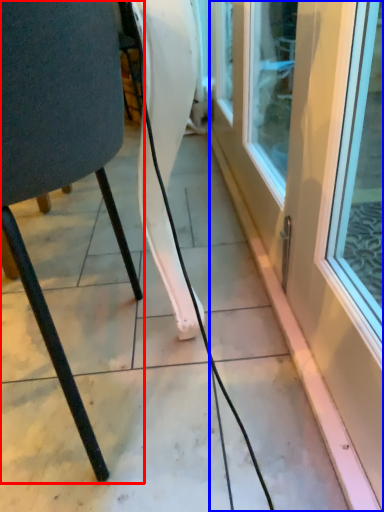
Question: Which object is further to the camera taking this photo, chair (highlighted by a red box) or door (highlighted by a blue box)?

Choices:
 (A) chair
 (B) door

Answer: (A)